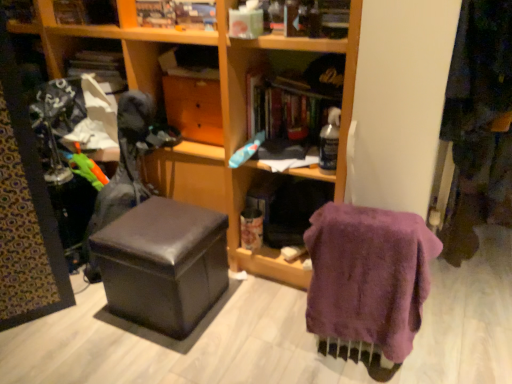
Question: From a real-world perspective, is purple fuzzy towel at lower right positioned above or below wooden drawer at center?

Choices:
 (A) above
 (B) below

Answer: (B)

Question: From the image's perspective, is purple fuzzy towel at lower right located above or below wooden drawer at center?

Choices:
 (A) above
 (B) below

Answer: (B)

Question: Estimate the real-world distances between objects in this image. Which object is closer to the matte black ottoman at center?

Choices:
 (A) wooden drawer at center
 (B) wooden bookshelf at upper center
 (C) wooden book at upper center, the 3th book viewed from the right
 (D) matte cardboard book at upper center, the 3th book in the left-to-right sequence
 (E) matte black swivel chair at center

Answer: (A)

Question: Which is farther from the matte black stool at center?

Choices:
 (A) wooden book at upper center, the second book in the left-to-right sequence
 (B) matte black ottoman at center
 (C) matte cardboard book at upper center, the 4th book viewed from the right
 (D) wooden bookshelf at upper center
 (E) purple fuzzy towel at lower right

Answer: (D)